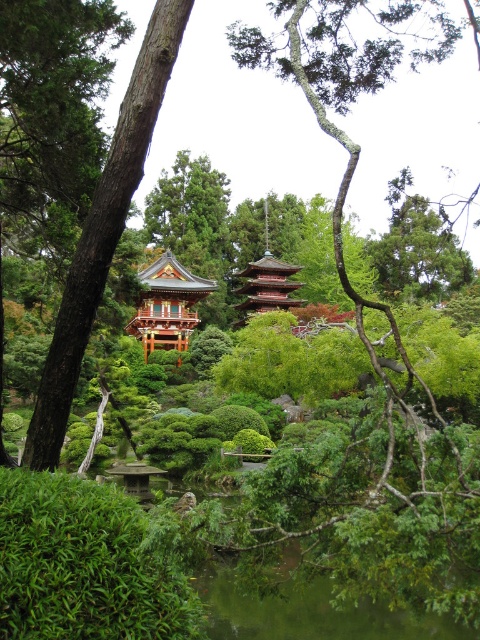
Question: Which point appears closest to the camera in this image?

Choices:
 (A) (72, 513)
 (B) (67, 349)
 (C) (153, 307)
 (D) (241, 307)

Answer: (A)

Question: Is shiny gold pagoda at center closer to camera compared to reddish-brown wooden pagoda at center?

Choices:
 (A) yes
 (B) no

Answer: (A)

Question: Which object is the farthest from the green textured tree at center?

Choices:
 (A) reddish-brown wooden pagoda at center
 (B) green leafy bush at lower left
 (C) shiny gold pagoda at center

Answer: (A)

Question: Which of the following is the farthest from the observer?

Choices:
 (A) (41, 609)
 (B) (180, 314)

Answer: (B)

Question: Does green leafy bush at lower left have a smaller size compared to reddish-brown wooden pagoda at center?

Choices:
 (A) no
 (B) yes

Answer: (B)

Question: Does green leafy bush at lower left appear over shiny gold pagoda at center?

Choices:
 (A) no
 (B) yes

Answer: (A)